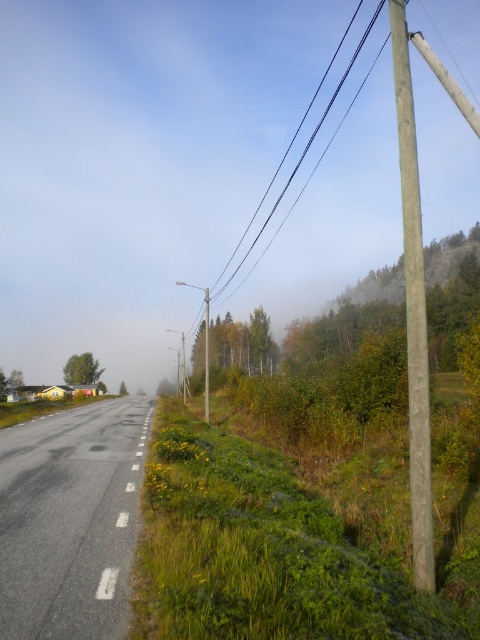
You are standing at the point with coordinates 0.5, 0.5 in the image. Which direction should you move to reach the asphalt road at center?

You should move towards the bottom right direction to reach the asphalt road at center because it is located at coordinates (71, 520), which is lower and to the right of your current position at (240, 320).

You are driving a car and need to park near the smooth gray pole at right and the smooth wire at upper right. Which object will you see first as you approach the road from the direction of the small cluster of buildings?

You will see the smooth gray pole at right first because it is in front of the smooth wire at upper right, making it closer to your viewpoint as you approach from the buildings.